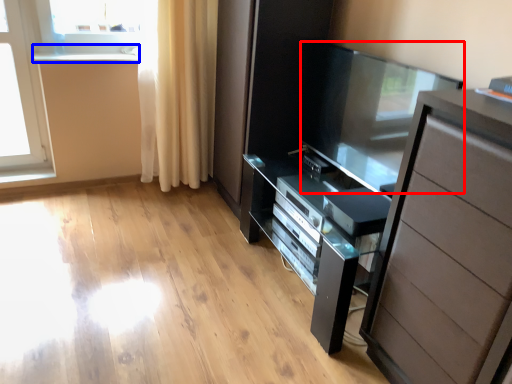
Question: Which point is closer to the camera, screen door (highlighted by a red box) or window sill (highlighted by a blue box)?

Choices:
 (A) screen door
 (B) window sill

Answer: (A)